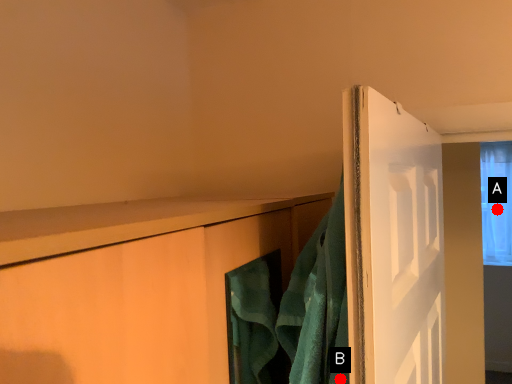
Question: Two points are circled on the image, labeled by A and B beside each circle. Which of the following is the farthest from the observer?

Choices:
 (A) A is further
 (B) B is further

Answer: (A)